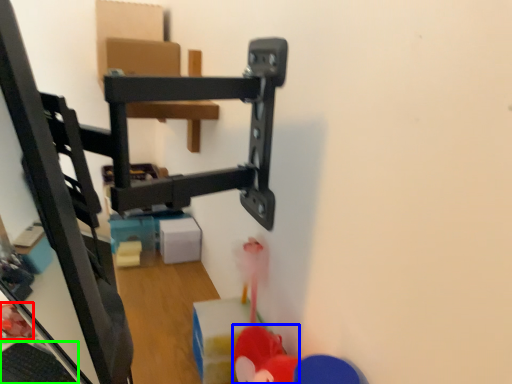
Question: Considering the real-world distances, which object is closest to toy (highlighted by a red box)? toy (highlighted by a blue box) or keyboard (highlighted by a green box).

Choices:
 (A) toy
 (B) keyboard

Answer: (B)